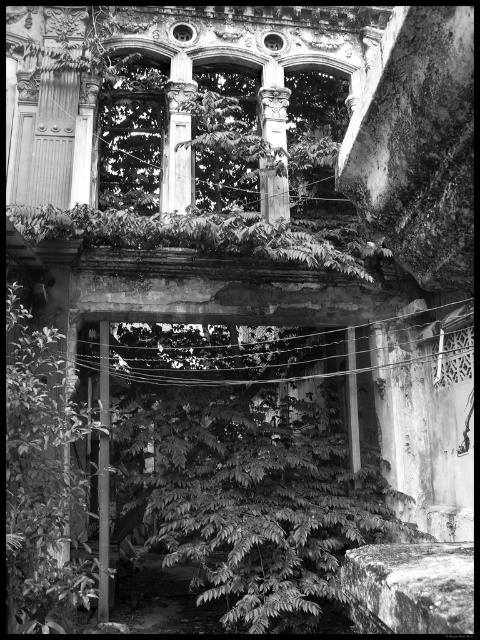
You are standing in front of the aged architectural structure. There is a point at coordinates point (x=41, y=481). What object is located at this point?

A: The point (x=41, y=481) corresponds to the green leafy tree at center.

Based on the scene described, which column is positioned lower in the image, the smooth white column at center or the smooth stone column at center?

The smooth white column at center is positioned below the smooth stone column at center, so it is lower in the image.